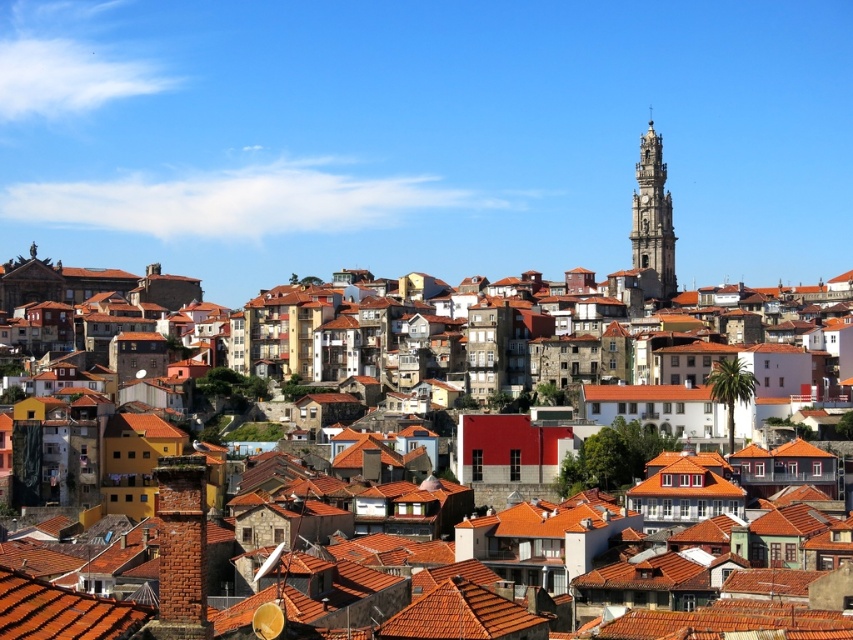
Question: Is terracotta clay rooftops at center wider than golden stone tower at upper right?

Choices:
 (A) no
 (B) yes

Answer: (B)

Question: Which point is farther to the camera?

Choices:
 (A) terracotta clay rooftops at center
 (B) golden stone tower at upper right

Answer: (B)

Question: Which object is farther from the camera taking this photo?

Choices:
 (A) golden stone tower at upper right
 (B) terracotta clay rooftops at center

Answer: (A)

Question: Is terracotta clay rooftops at center smaller than golden stone tower at upper right?

Choices:
 (A) yes
 (B) no

Answer: (B)

Question: Can you confirm if terracotta clay rooftops at center is positioned below golden stone tower at upper right?

Choices:
 (A) no
 (B) yes

Answer: (B)

Question: Which point is closer to the camera taking this photo?

Choices:
 (A) (665, 252)
 (B) (560, 413)

Answer: (B)